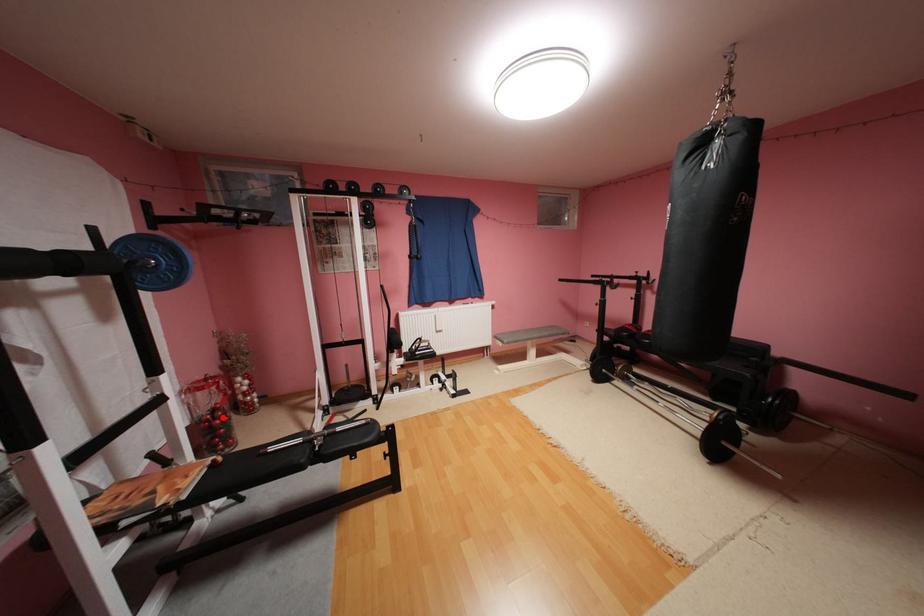
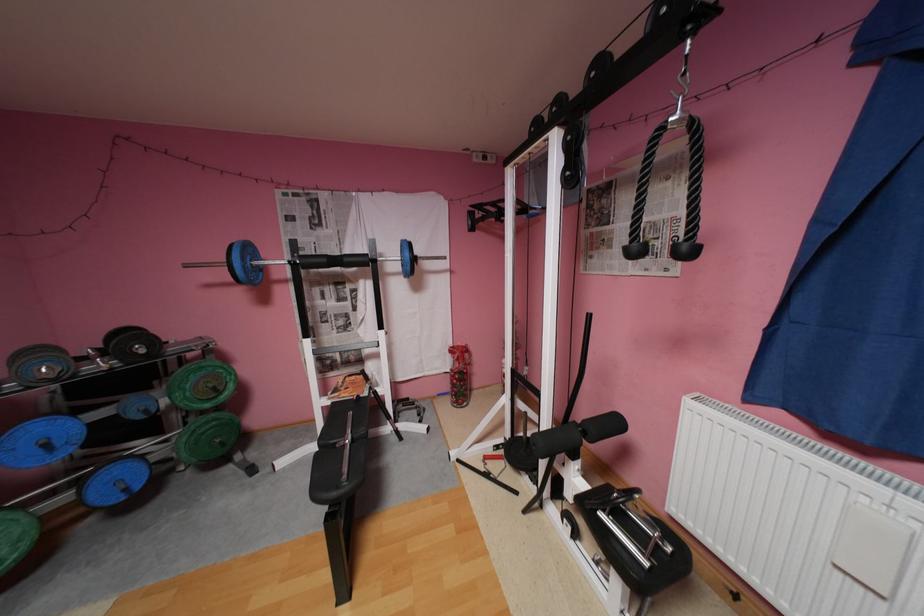
Question: I am providing you with two images of the same scene from different viewpoints. A red point is marked on the first image. At the location where the point appears in image 1, is it still visible in image 2?

Choices:
 (A) Yes
 (B) No

Answer: (A)